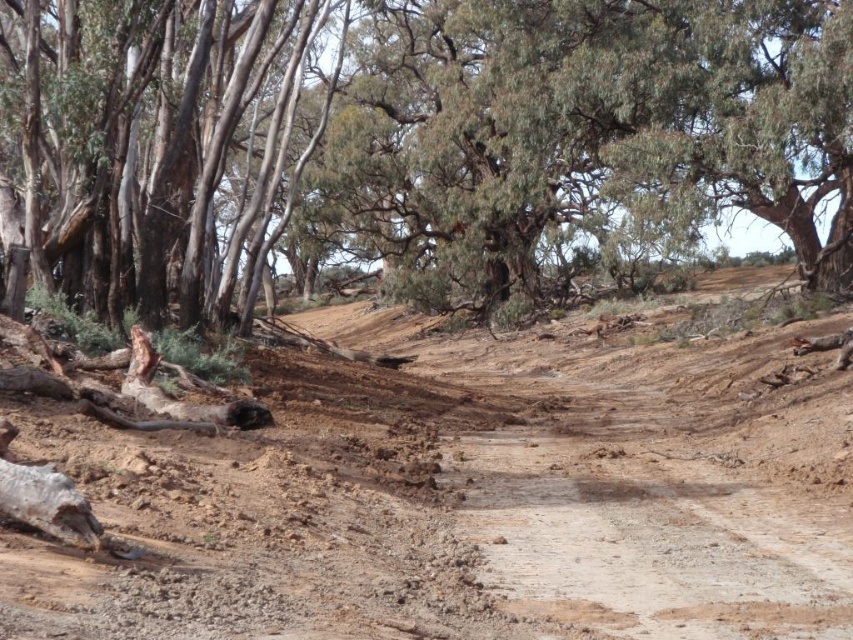
Can you confirm if dull brown dirt at center is smaller than smooth bark tree at upper left?

Indeed, dull brown dirt at center has a smaller size compared to smooth bark tree at upper left.

Which of these two, dull brown dirt at center or smooth bark tree at upper left, stands taller?

smooth bark tree at upper left is taller.

Is point (181, 573) positioned in front of point (111, 80)?

Yes.

In order to click on dull brown dirt at center in this screenshot , I will do click(x=462, y=499).

Between brown rough tree at upper left and dull brown dirt at center, which one is positioned lower?

dull brown dirt at center

Is brown rough tree at upper left below dull brown dirt at center?

Incorrect, brown rough tree at upper left is not positioned below dull brown dirt at center.

Does point (480, 112) come farther from viewer compared to point (206, 477)?

Yes, it is.

I want to click on brown rough tree at upper left, so click(x=413, y=141).

Does brown rough tree at upper left have a greater height compared to smooth bark tree at upper left?

No, brown rough tree at upper left is not taller than smooth bark tree at upper left.

Which is more to the left, brown rough tree at upper left or smooth bark tree at upper left?

smooth bark tree at upper left is more to the left.

What do you see at coordinates (413, 141) in the screenshot?
I see `brown rough tree at upper left` at bounding box center [413, 141].

This screenshot has height=640, width=853. What are the coordinates of `brown rough tree at upper left` in the screenshot? It's located at [413, 141].